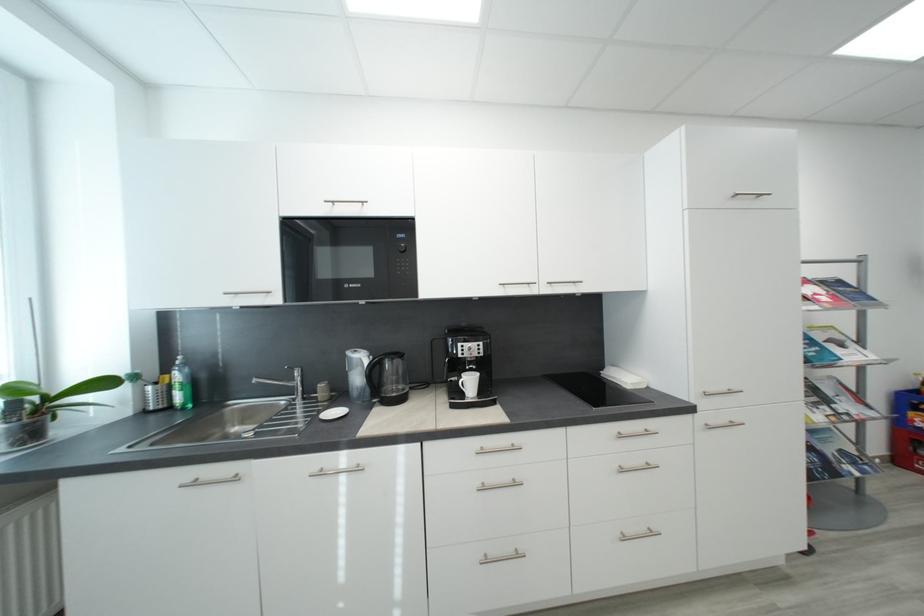
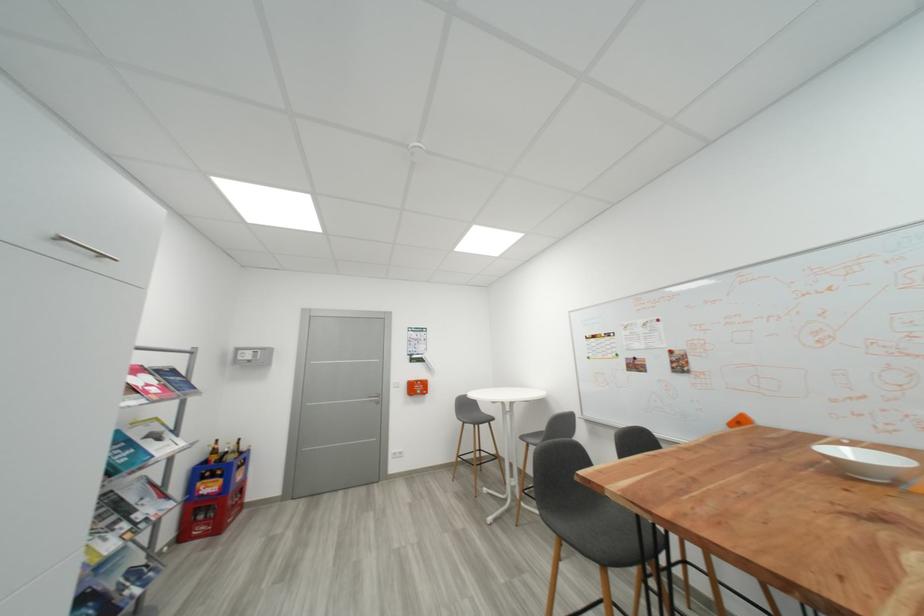
Question: How did the camera likely rotate?

Choices:
 (A) Left
 (B) Right
 (C) Up
 (D) Down

Answer: (B)